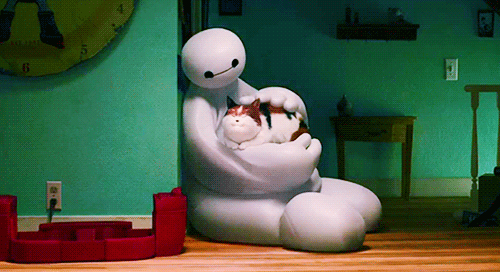
Find the location of `demilune table`. demilune table is located at coordinates (384, 131).